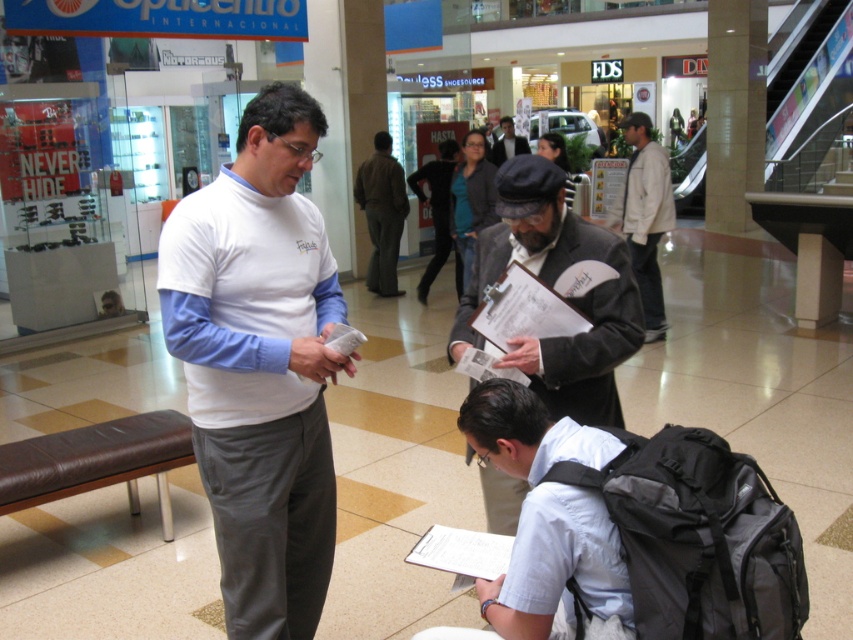
Question: Among these objects, which one is nearest to the camera?

Choices:
 (A) white shirt at lower center
 (B) khaki pants at center

Answer: (A)

Question: Is light beige jacket at center below khaki pants at center?

Choices:
 (A) no
 (B) yes

Answer: (B)

Question: Which of these objects is positioned farthest from the khaki pants at center?

Choices:
 (A) matte black suit at center
 (B) light beige jacket at center
 (C) white cotton shirt at center
 (D) white shirt at lower center

Answer: (D)

Question: Which object is farther from the camera taking this photo?

Choices:
 (A) matte black suit at center
 (B) white cotton shirt at center
 (C) dark gray leather jacket at center
 (D) white shirt at lower center

Answer: (A)

Question: Can you confirm if white cotton shirt at center is wider than white shirt at lower center?

Choices:
 (A) yes
 (B) no

Answer: (A)

Question: Is white cotton shirt at center bigger than light beige jacket at center?

Choices:
 (A) yes
 (B) no

Answer: (B)